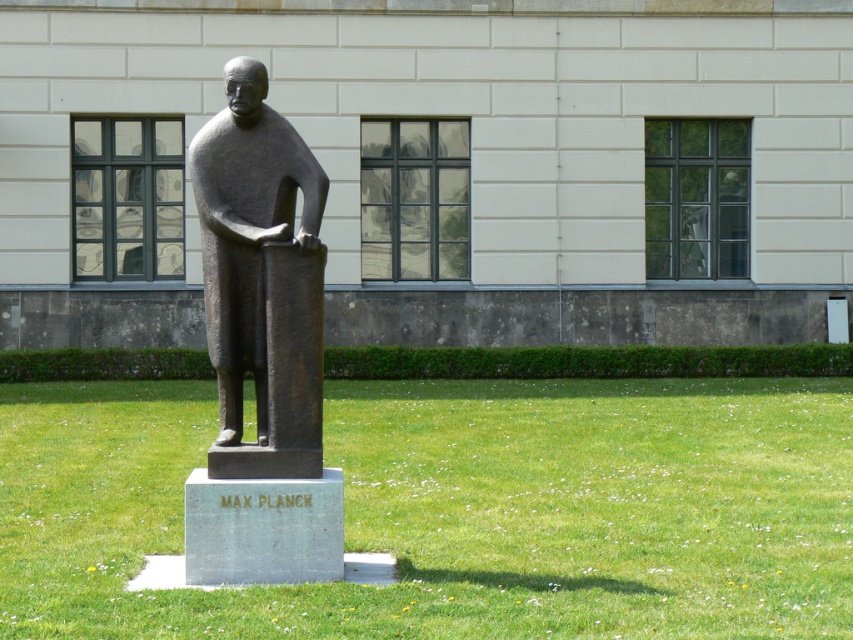
You are a photographer standing at the base of the statue. You want to take a photo that includes both the point at coordinates point (689,515) and point (216,371). Which point should you focus on first to ensure both are in focus?

You should focus on point (216,371) first because it is closer to you than point (689,515), which is further away. This ensures both points are within the depth of field.

You are a gardener who needs to water the green grass at center and the bronze statue at center. Since the statue is in the way, which direction should you move it to access the grass?

The green grass at center is on the right side of the bronze statue at center, so you should move the bronze statue at center to the left to access the green grass at center.

You are a gardener who needs to mow the lawn. The bronze statue at center is in the way. Can you move it to the side to access the green grass at center?

The green grass at center has a larger size compared to bronze statue at center, so the statue can be moved to the side to access the green grass at center.